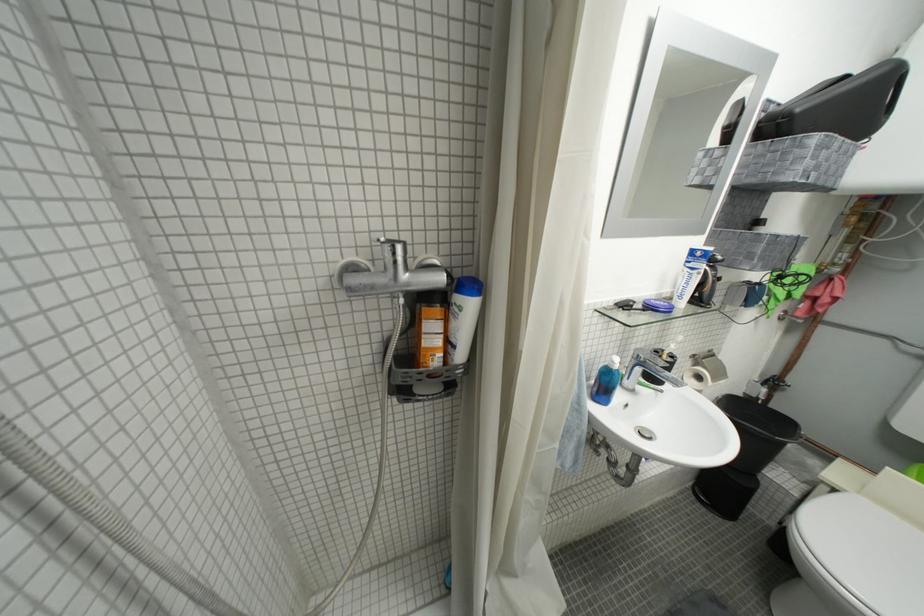
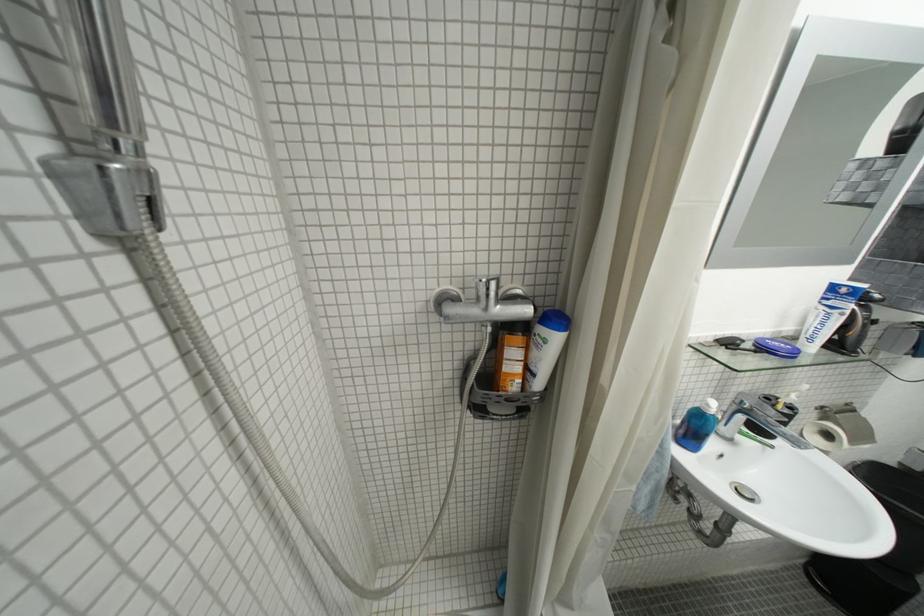
Where in the second image is the point corresponding to (x=626, y=307) from the first image?

(725, 342)